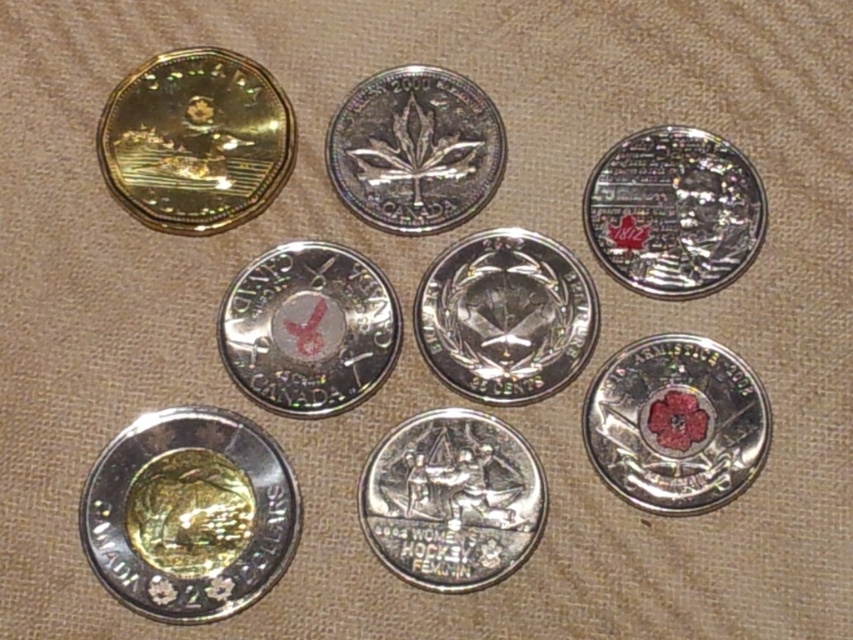
Can you confirm if shiny gold coin at bottom left is positioned to the right of silver/metallic hockey coin at center?

No, shiny gold coin at bottom left is not to the right of silver/metallic hockey coin at center.

Which is above, shiny gold coin at bottom left or silver/metallic hockey coin at center?

silver/metallic hockey coin at center is higher up.

Locate an element on the screen. shiny gold coin at bottom left is located at coordinates (189, 515).

Image resolution: width=853 pixels, height=640 pixels. What do you see at coordinates (196, 140) in the screenshot? I see `gold holographic coin at upper left` at bounding box center [196, 140].

Does point (192, 88) come farther from viewer compared to point (432, 284)?

That is True.

Is point (227, 104) more distant than point (584, 273)?

Yes, it is behind point (584, 273).

Identify the location of gold holographic coin at upper left. pos(196,140).

Does shiny gold coin at bottom left have a smaller size compared to glossy silver coin at center?

No, shiny gold coin at bottom left is not smaller than glossy silver coin at center.

You are a GUI agent. You are given a task and a screenshot of the screen. Output one action in this format:
    pyautogui.click(x=<x>, y=<y>)
    Task: Click on the shiny gold coin at bottom left
    The image size is (853, 640).
    Given the screenshot: What is the action you would take?
    pyautogui.click(x=189, y=515)